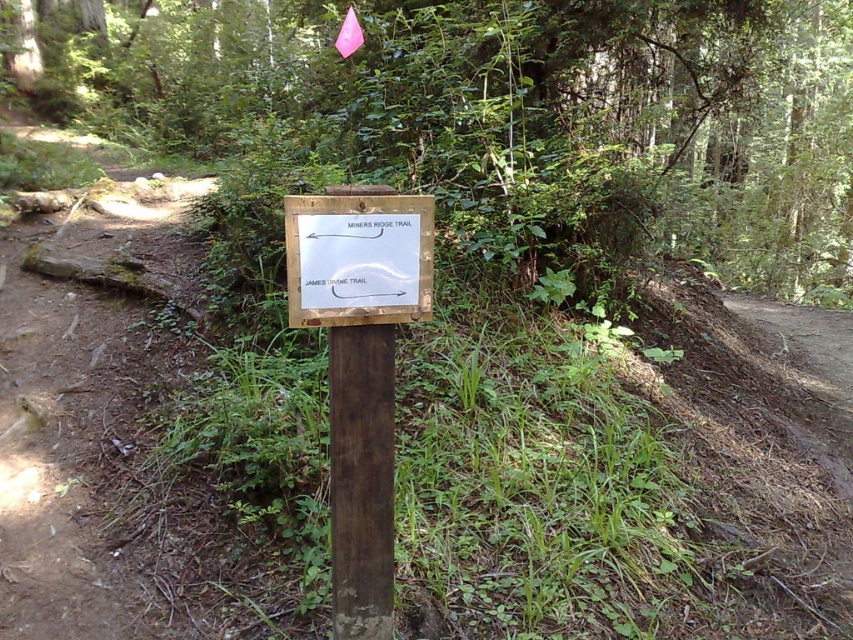
Question: Which point is closer to the camera?

Choices:
 (A) white paper sign at center
 (B) dark brown wood at center
 (C) brown wooden signpost at center

Answer: (A)

Question: Which point appears closest to the camera in this image?

Choices:
 (A) (469, 131)
 (B) (339, 596)
 (C) (422, 310)

Answer: (C)

Question: Among these points, which one is farthest from the camera?

Choices:
 (A) click(363, 250)
 (B) click(553, 13)
 (C) click(331, 388)

Answer: (B)

Question: Does brown wooden signpost at center have a lesser width compared to dark brown wood at center?

Choices:
 (A) no
 (B) yes

Answer: (A)

Question: Is dark brown wood at center thinner than white paper sign at center?

Choices:
 (A) no
 (B) yes

Answer: (B)

Question: Does brown wooden signpost at center appear under dark brown wood at center?

Choices:
 (A) yes
 (B) no

Answer: (B)